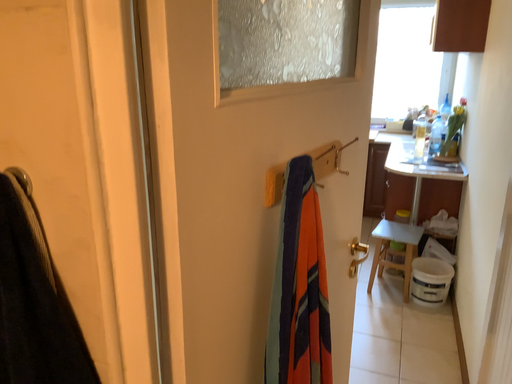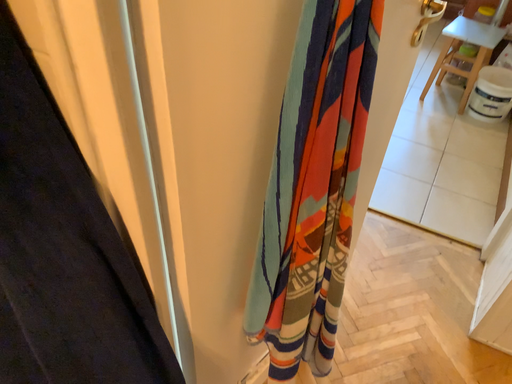
Question: Which way did the camera rotate in the video?

Choices:
 (A) rotated upward
 (B) rotated downward

Answer: (B)